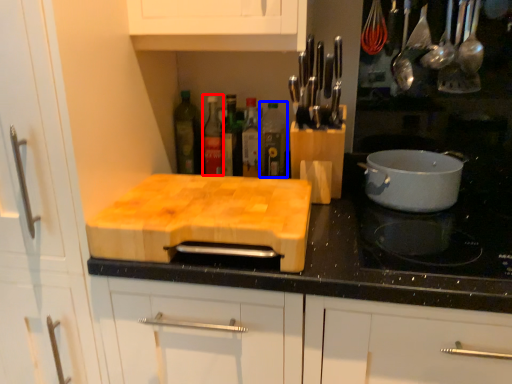
Question: Among these objects, which one is nearest to the camera, bottle (highlighted by a red box) or bottle (highlighted by a blue box)?

Choices:
 (A) bottle
 (B) bottle

Answer: (B)